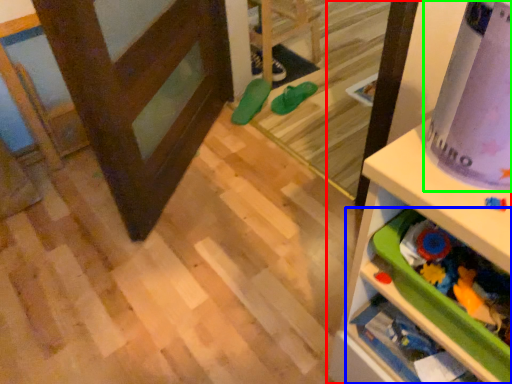
Question: Which object is positioned closest to shelf (highlighted by a red box)? Select from shelf (highlighted by a blue box) and wrapping paper (highlighted by a green box).

Choices:
 (A) shelf
 (B) wrapping paper

Answer: (A)